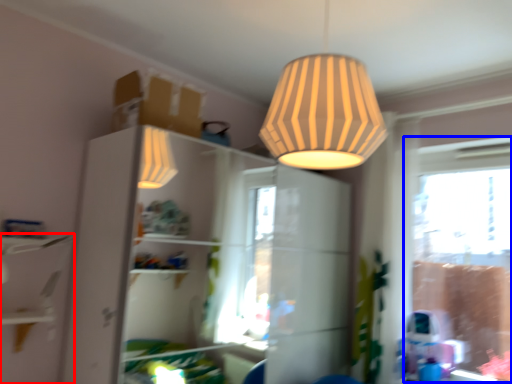
Question: Which object is closer to the camera taking this photo, shelf (highlighted by a red box) or window frame (highlighted by a blue box)?

Choices:
 (A) shelf
 (B) window frame

Answer: (A)